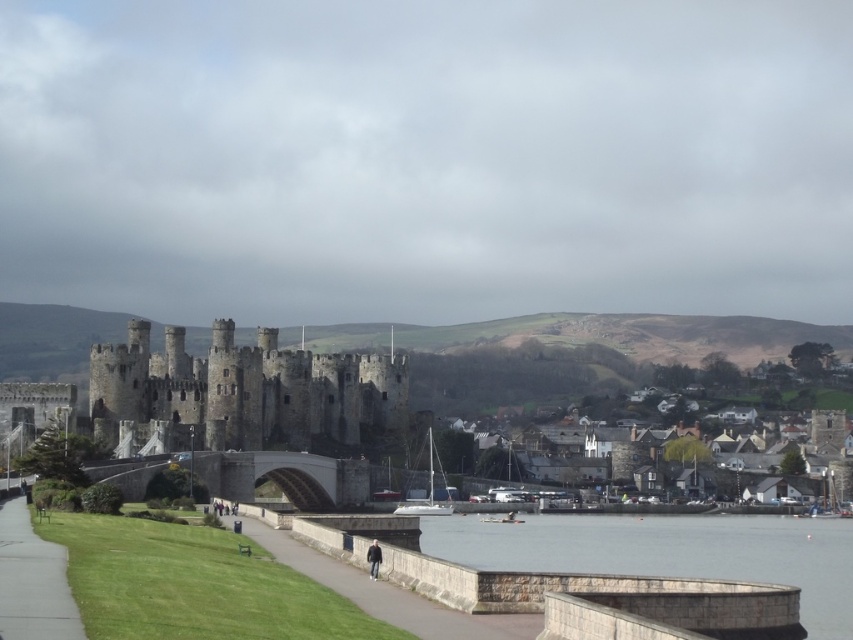
Between dark gray stone castle at center and green grass at lower left, which one has less height?

Standing shorter between the two is green grass at lower left.

Can you confirm if dark gray stone castle at center is thinner than green grass at lower left?

No.

Is point (405, 413) farther from viewer compared to point (6, 618)?

That is True.

The image size is (853, 640). Identify the location of dark gray stone castle at center. (248, 388).

Image resolution: width=853 pixels, height=640 pixels. What do you see at coordinates (669, 552) in the screenshot? I see `gray stone water at lower right` at bounding box center [669, 552].

Is gray stone water at lower right smaller than dark gray jacket at lower center?

No, gray stone water at lower right is not smaller than dark gray jacket at lower center.

At what (x,y) coordinates should I click in order to perform the action: click on gray stone water at lower right. Please return your answer as a coordinate pair (x, y). Looking at the image, I should click on (669, 552).

Describe the element at coordinates (669, 552) in the screenshot. I see `gray stone water at lower right` at that location.

Which of these two, gray stone water at lower right or green grass at lower left, stands taller?

gray stone water at lower right

Locate an element on the screen. gray stone water at lower right is located at coordinates (669, 552).

The height and width of the screenshot is (640, 853). I want to click on gray stone water at lower right, so click(669, 552).